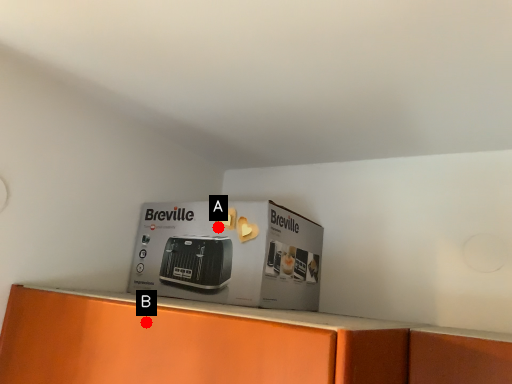
Question: Two points are circled on the image, labeled by A and B beside each circle. Among these points, which one is nearest to the camera?

Choices:
 (A) A is closer
 (B) B is closer

Answer: (B)